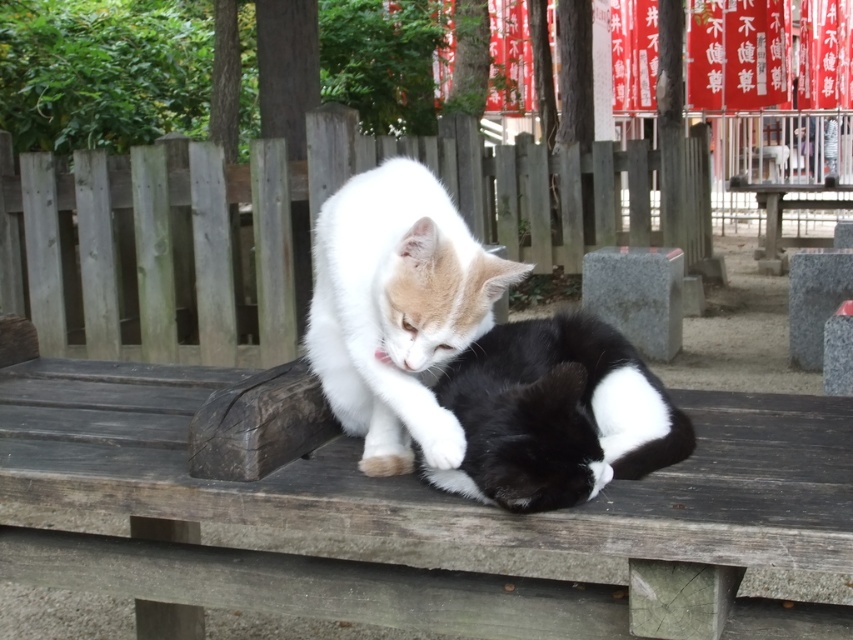
What do you see at coordinates (396, 308) in the screenshot? This screenshot has height=640, width=853. I see `white fluffy cat at center` at bounding box center [396, 308].

Identify the location of white fluffy cat at center. (396, 308).

Find the location of `white fluffy cat at center`. white fluffy cat at center is located at coordinates (396, 308).

Is white fluffy cat at center closer to the viewer compared to black soft fur cat at center?

No, it is not.

Who is positioned more to the right, white fluffy cat at center or black soft fur cat at center?

black soft fur cat at center is more to the right.

This screenshot has width=853, height=640. I want to click on white fluffy cat at center, so click(396, 308).

Looking at this image, can you confirm if black soft fur cat at center is smaller than wooden picnic table at center?

Indeed, black soft fur cat at center has a smaller size compared to wooden picnic table at center.

At what (x,y) coordinates should I click in order to perform the action: click on black soft fur cat at center. Please return your answer as a coordinate pair (x, y). This screenshot has width=853, height=640. Looking at the image, I should click on (555, 413).